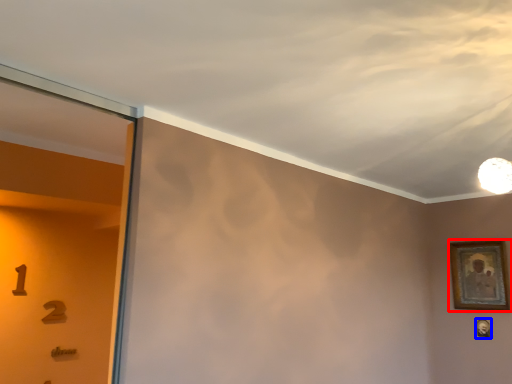
Question: Which object is closer to the camera taking this photo, picture frame (highlighted by a red box) or picture frame (highlighted by a blue box)?

Choices:
 (A) picture frame
 (B) picture frame

Answer: (A)